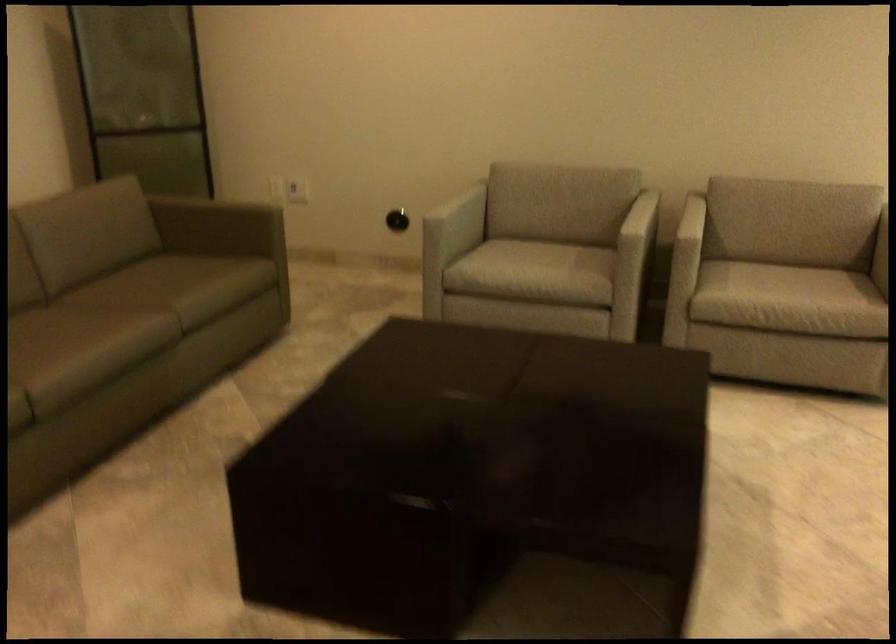
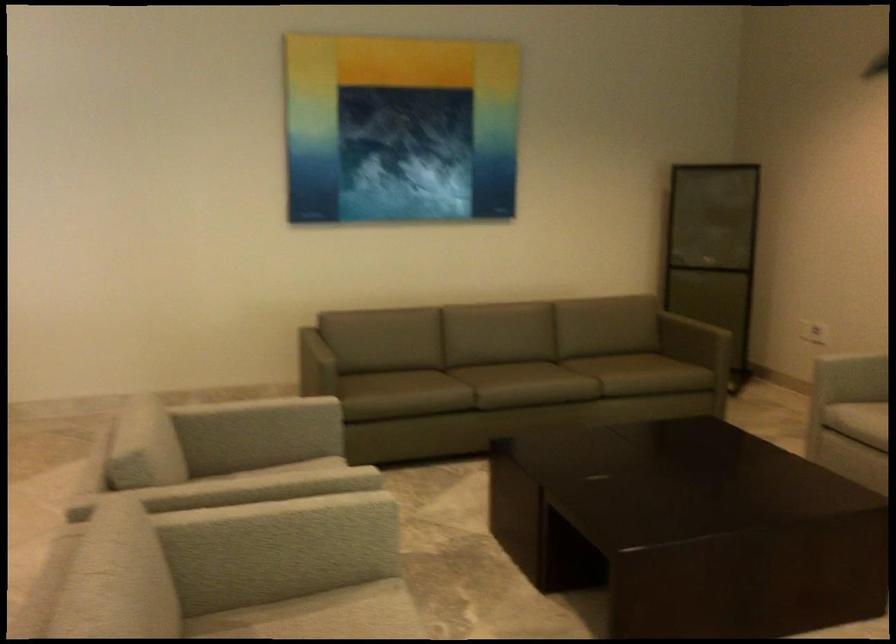
In the second image, find the point that corresponds to (493,265) in the first image.

(857, 420)